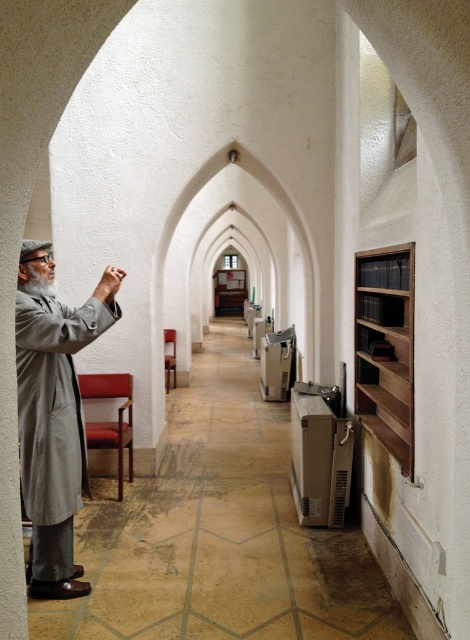
You are a visitor in this corridor and need to move from the light gray woolen robe at left to the dark brown wooden bookshelf at right. Is there enough space for you to walk directly between them?

The distance between the light gray woolen robe at left and the dark brown wooden bookshelf at right is 5.50 feet, which should be sufficient for a person to walk directly between them.

You are standing in the corridor and want to pick up the light gray woolen robe at left. According to the coordinates provided, where exactly should you look to find it?

The light gray woolen robe at left is located at the 2D coordinates point [53,419], so you should look there to find it.

You are a visitor in this corridor and want to hang a coat on the wall. The coat is as wide as the light gray woolen robe at left. Will there be enough space between the robe and the dark brown wooden bookshelf at right to hang your coat without it touching either?

The light gray woolen robe at left is wider than the dark brown wooden bookshelf at right. However, the question asks about the space between them, not their widths. Since the corridor is narrow and the robe and bookshelf are positioned on opposite sides, there might not be sufficient space between them for the coat. Please check the actual distance before hanging.